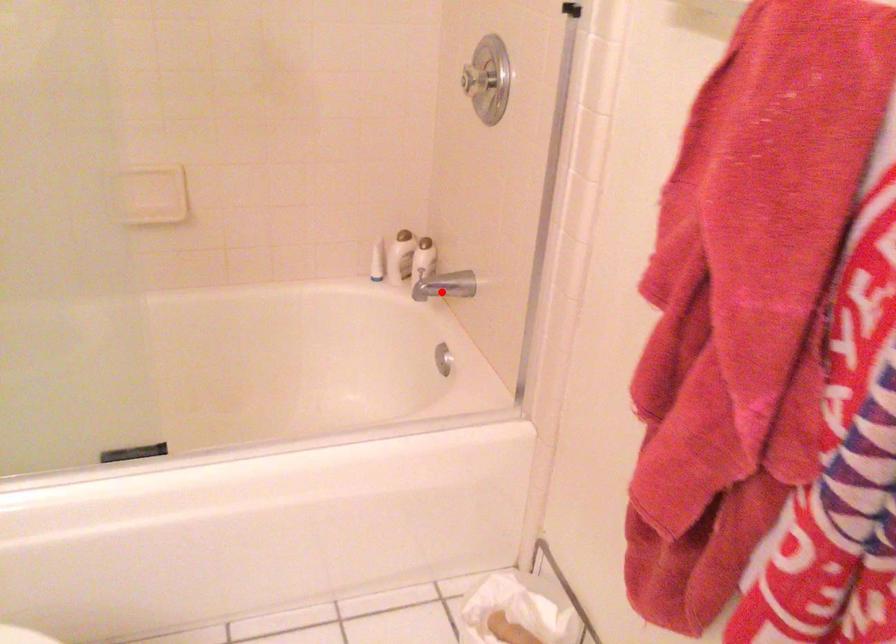
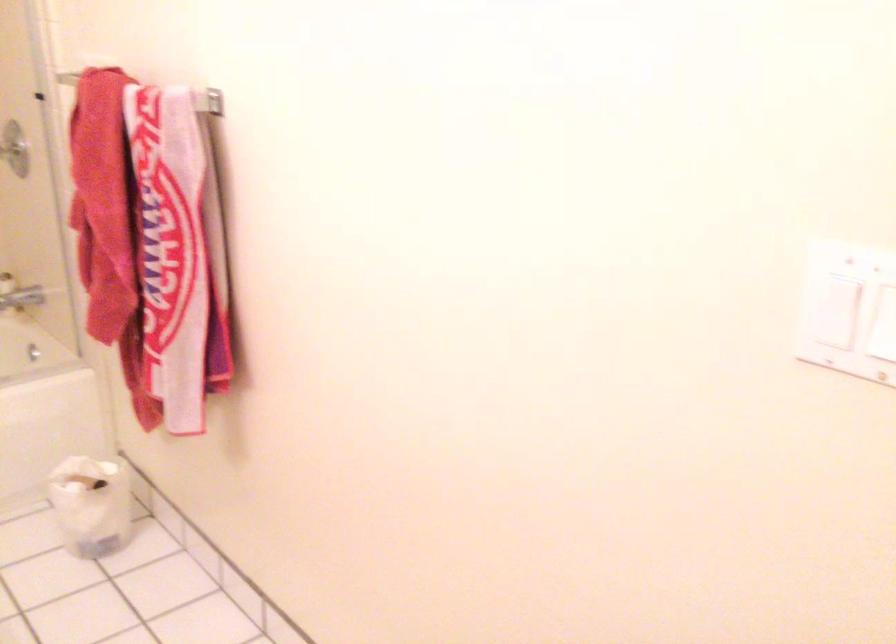
Question: A red point is marked in image1. In image2, is the corresponding 3D point closer to the camera or farther? Reply with the corresponding letter.

Choices:
 (A) The corresponding 3D point is closer.
 (B) The corresponding 3D point is farther.

Answer: (B)